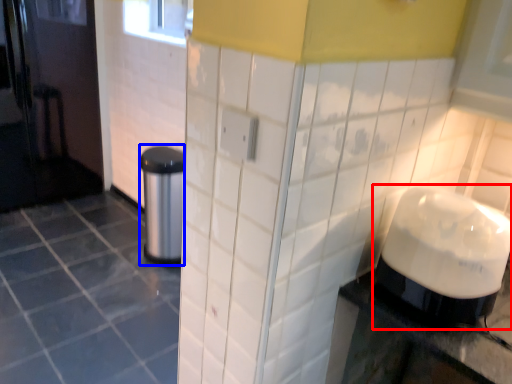
Question: Which object is further to the camera taking this photo, blender (highlighted by a red box) or appliance (highlighted by a blue box)?

Choices:
 (A) blender
 (B) appliance

Answer: (B)